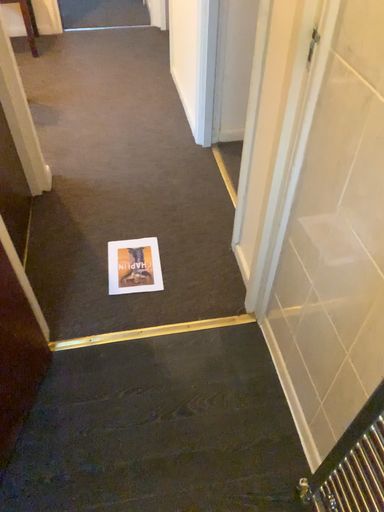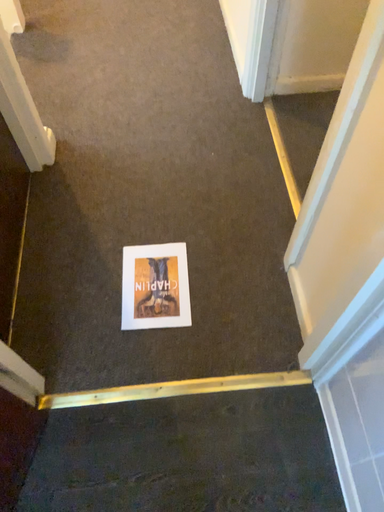
Question: Which way did the camera rotate in the video?

Choices:
 (A) rotated downward
 (B) rotated upward

Answer: (A)